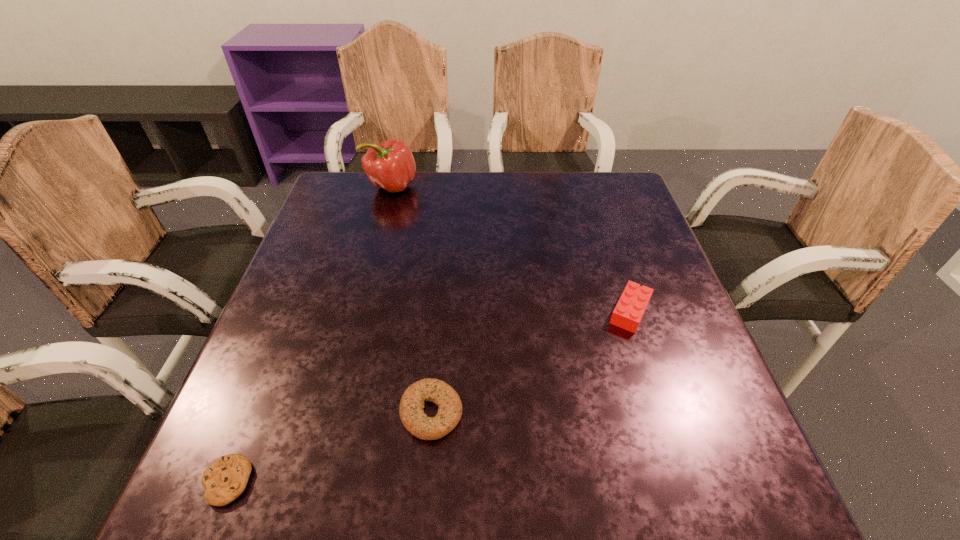
Where is `vacant region at the near edge of the desktop`? vacant region at the near edge of the desktop is located at coordinates (504, 509).

In the image, there is a desktop. At what (x,y) coordinates should I click in order to perform the action: click on vacant space at the left edge. Please return your answer as a coordinate pair (x, y). The image size is (960, 540). Looking at the image, I should click on (314, 292).

Identify the location of vacant space at the right edge of the desktop. (663, 433).

This screenshot has height=540, width=960. In order to click on vacant space at the near left corner of the desktop in this screenshot , I will do coord(188,496).

In the image, there is a desktop. Where is `free space at the far right corner`? free space at the far right corner is located at coordinates (617, 187).

The image size is (960, 540). Identify the location of vacant area between the third nearest object and the tallest object. (511, 249).

Locate an element on the screen. The height and width of the screenshot is (540, 960). unoccupied area between the leftmost object and the third farthest object is located at coordinates (329, 447).

Locate an element on the screen. Image resolution: width=960 pixels, height=540 pixels. free area in between the second nearest object and the tallest object is located at coordinates (412, 299).

The width and height of the screenshot is (960, 540). Find the location of `unoccupied area between the cookie and the second object from left to right`. unoccupied area between the cookie and the second object from left to right is located at coordinates (309, 334).

Find the location of `free area in between the bagel and the nearest object`. free area in between the bagel and the nearest object is located at coordinates click(329, 447).